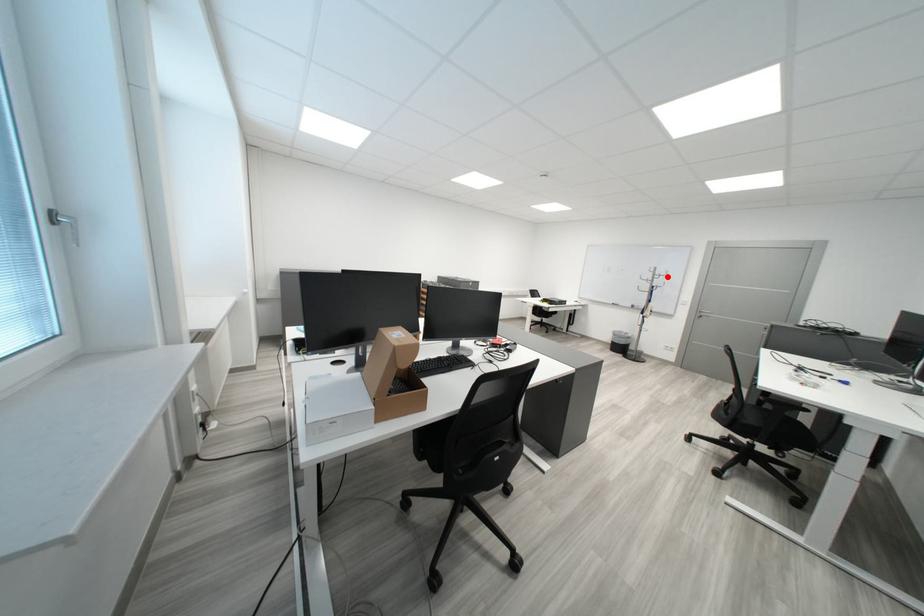
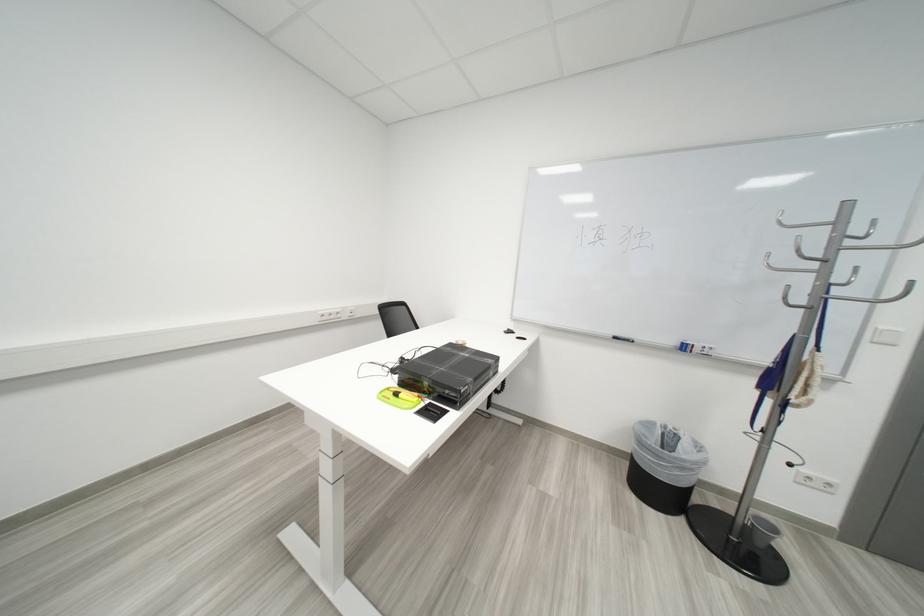
Question: I am providing you with two images of the same scene from different viewpoints. A red point is shown in image1. For the corresponding object point in image2, is it positioned nearer or farther from the camera?

Choices:
 (A) Nearer
 (B) Farther

Answer: (B)